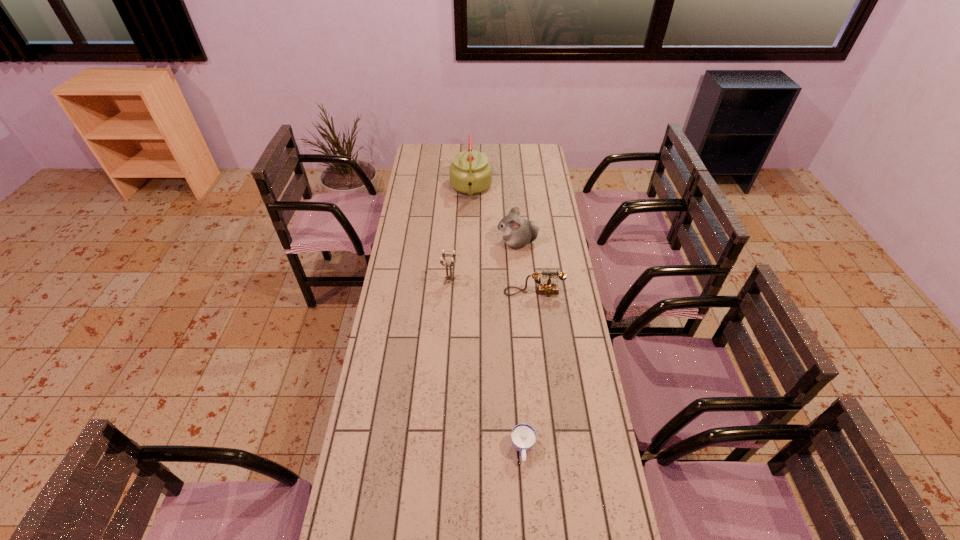
Image resolution: width=960 pixels, height=540 pixels. What are the coordinates of `blank space located on the face of the hamster` in the screenshot? It's located at (464, 242).

Locate an element on the screen. Image resolution: width=960 pixels, height=540 pixels. free region located on the face of the hamster is located at coordinates (472, 242).

You are a GUI agent. You are given a task and a screenshot of the screen. Output one action in this format:
    pyautogui.click(x=<x>, y=<y>)
    Task: Click on the vacant region located 0.220m on the left of the candle holder
    
    Given the screenshot: What is the action you would take?
    pyautogui.click(x=389, y=281)

This screenshot has height=540, width=960. Find the location of `vacant space situated on the front-facing side of the fourth tallest object`. vacant space situated on the front-facing side of the fourth tallest object is located at coordinates (536, 307).

You are a GUI agent. You are given a task and a screenshot of the screen. Output one action in this format:
    pyautogui.click(x=<x>, y=<y>)
    Task: Click on the free space located on the side of the shortest object with the handle
    The width and height of the screenshot is (960, 540).
    Given the screenshot: What is the action you would take?
    pyautogui.click(x=525, y=486)

Where is `hamster that is at the right edge`? The width and height of the screenshot is (960, 540). hamster that is at the right edge is located at coordinates (517, 232).

Locate an element on the screen. telephone at the right edge is located at coordinates (548, 288).

Where is `free space at the far edge of the desktop`? This screenshot has width=960, height=540. free space at the far edge of the desktop is located at coordinates (x=446, y=151).

The image size is (960, 540). In order to click on vacant space at the left edge of the desktop in this screenshot , I will do `click(421, 170)`.

In the image, there is a desktop. Identify the location of vacant space at the right edge. (534, 245).